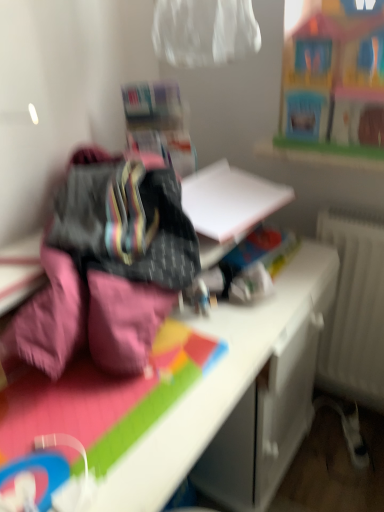
Question: Does point (87, 231) appear closer or farther from the camera than point (322, 135)?

Choices:
 (A) farther
 (B) closer

Answer: (B)

Question: From a real-world perspective, is pink fabric at left above or below wooden toy house at upper right?

Choices:
 (A) below
 (B) above

Answer: (A)

Question: Estimate the real-world distances between objects in this image. Which object is farther from the white glossy desk at center?

Choices:
 (A) pink fabric at left
 (B) wooden toy house at upper right

Answer: (B)

Question: Which object is positioned farthest from the white glossy desk at center?

Choices:
 (A) wooden toy house at upper right
 (B) pink fabric at left

Answer: (A)